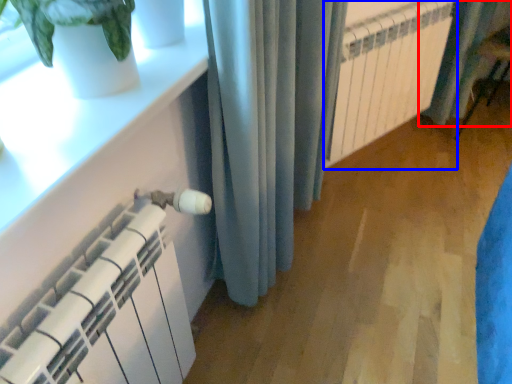
Question: Among these objects, which one is nearest to the camera, curtain (highlighted by a red box) or radiator (highlighted by a blue box)?

Choices:
 (A) curtain
 (B) radiator

Answer: (B)